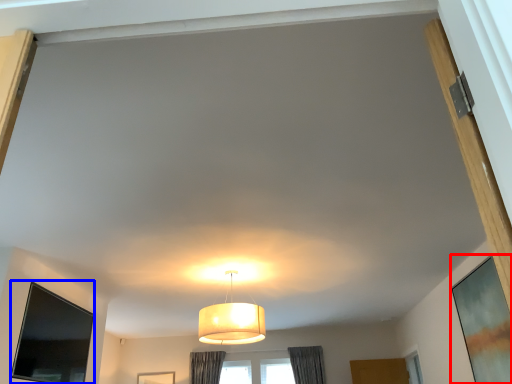
Question: Which point is further to the camera, window screen (highlighted by a red box) or window screen (highlighted by a blue box)?

Choices:
 (A) window screen
 (B) window screen

Answer: (B)